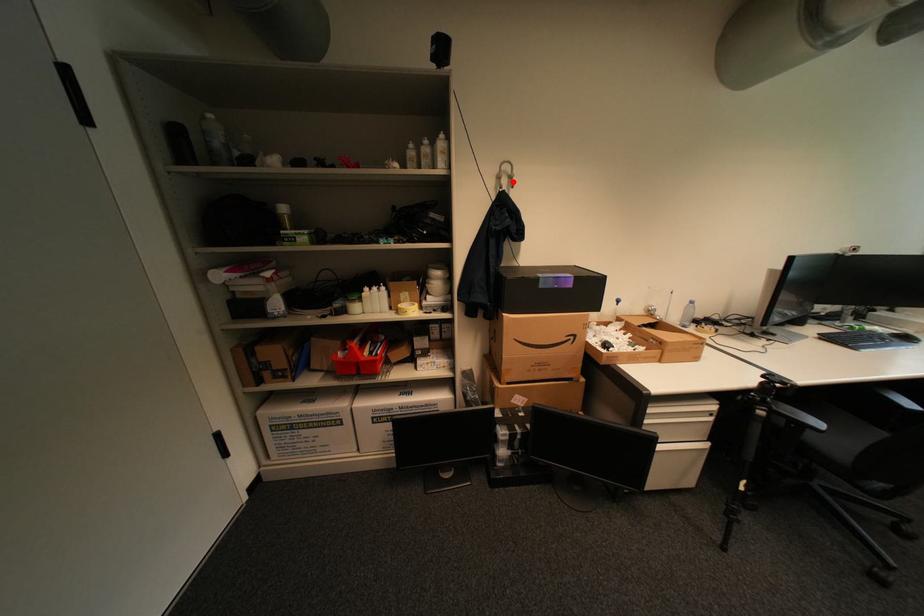
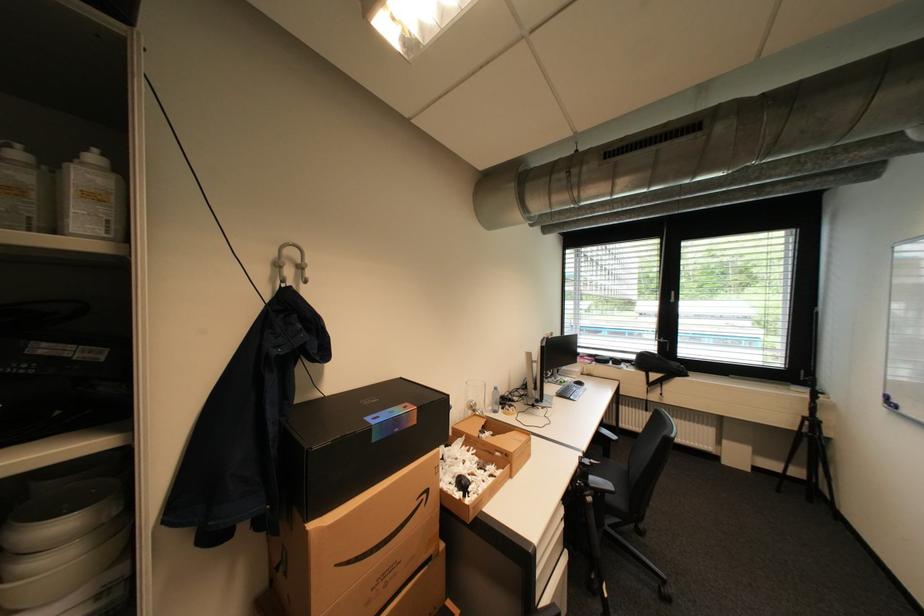
Locate, in the second image, the point that corresponds to the highlighted location in the first image.

(297, 272)